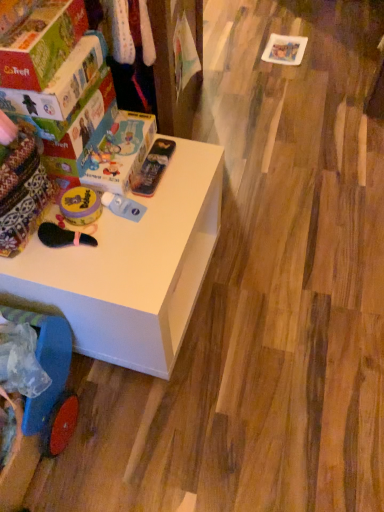
Locate an element on the screen. The width and height of the screenshot is (384, 512). free space in front of yellow matte bubble container at center, acting as the 2th toy starting from the left is located at coordinates (127, 259).